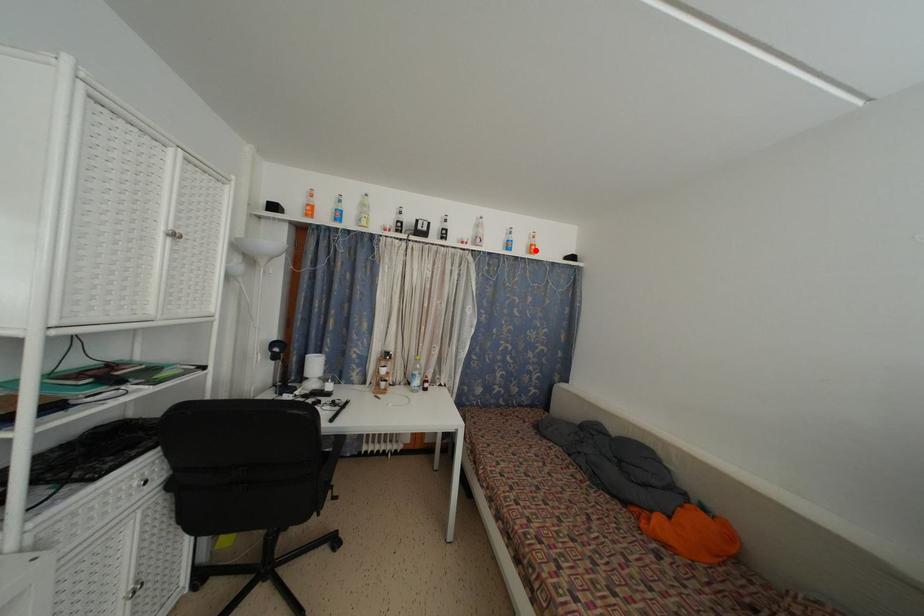
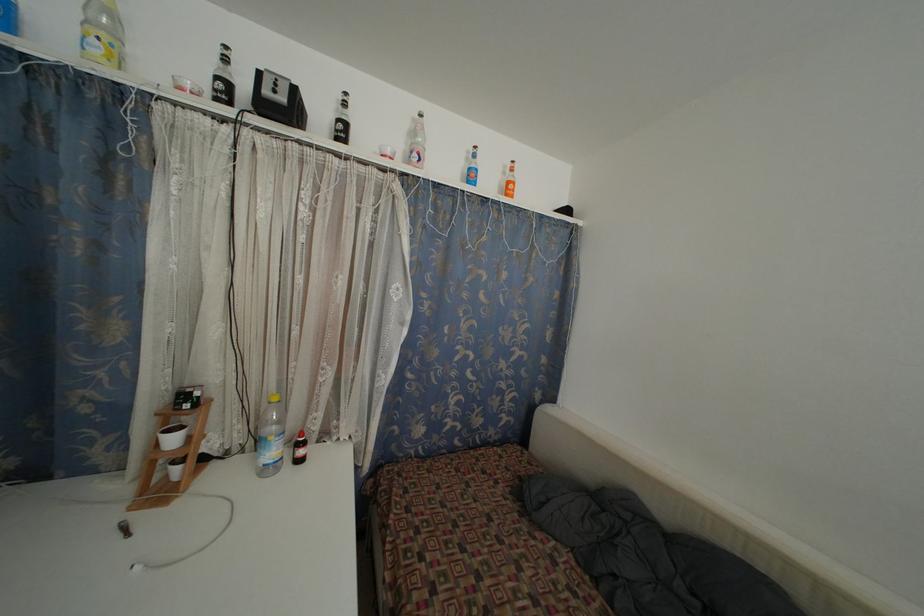
Question: I am providing you with two images of the same scene from different viewpoints. A red point is marked on the first image. At the location where the point appears in image 1, is it still visible in image 2?

Choices:
 (A) Yes
 (B) No

Answer: (A)